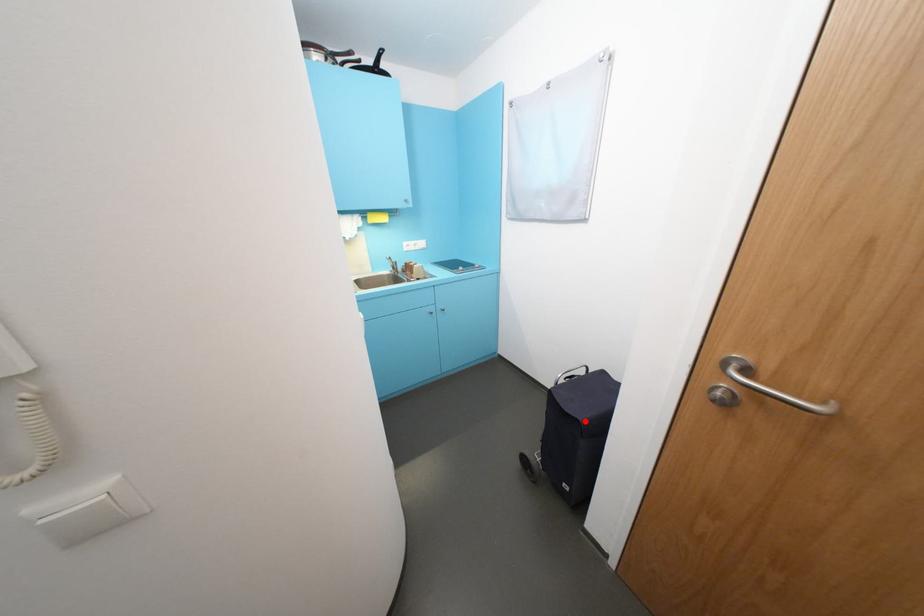
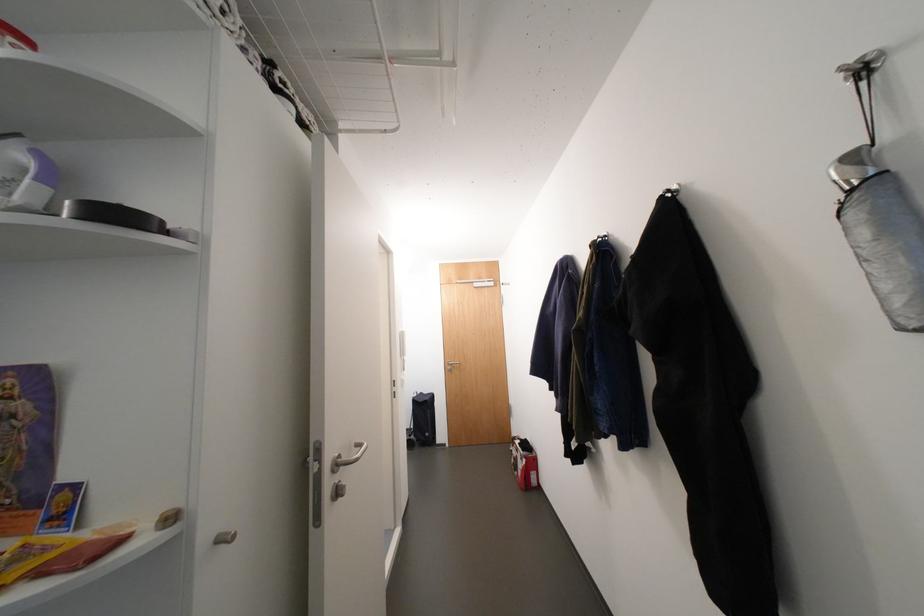
Question: I am providing you with two images of the same scene from different viewpoints. Given a red point in image1, look at the same physical point in image2. Is it:

Choices:
 (A) Closer to the viewpoint
 (B) Farther from the viewpoint

Answer: (B)